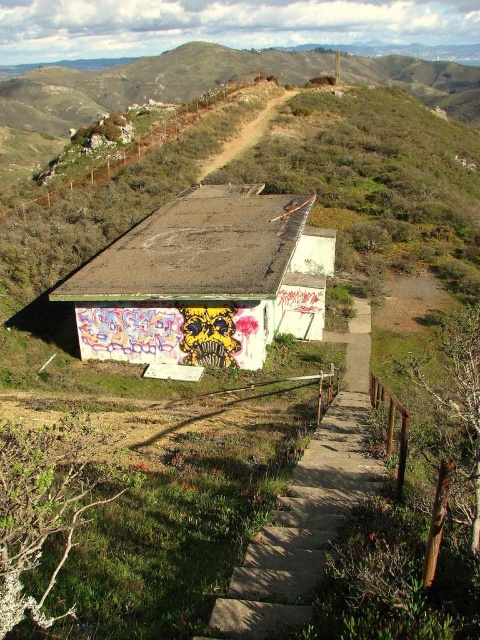
You are standing at the base of the hill looking up at the abandoned building. There are two points marked on the image, point 1 at coordinates (194,189) and point 2 at (287,529). Which point is closer to you?

Point 2 at (287,529) is closer to you because it is less further to the camera than point 1 at (194,189).